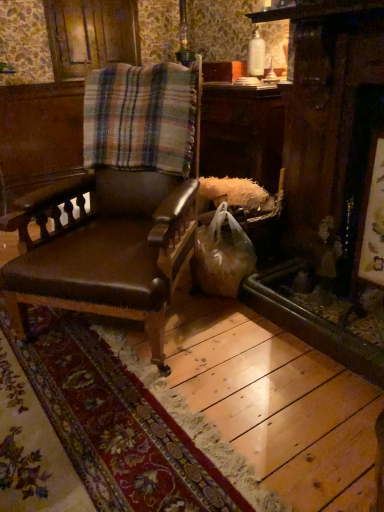
At what (x,y) coordinates should I click in order to perform the action: click on free location in front of matte brown leather chair at center. Please return your answer as a coordinate pair (x, y). Looking at the image, I should click on (146, 415).